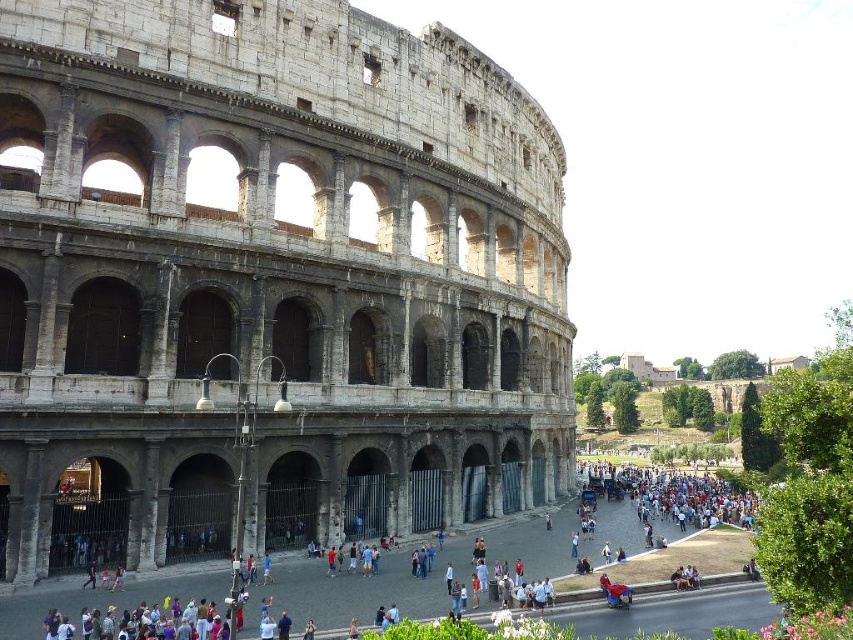
You are standing at the point with coordinates (273, 276) in the Colosseum image. What structure are you currently on?

The point with coordinates (273, 276) is on the gray stone amphitheater at center.

You are a tourist standing in front of the Colosseum and want to take a photo of the gray stone amphitheater at center and the matte gray crowd at center. Which object should you focus on first if you want to capture both in the same frame?

The gray stone amphitheater at center is to the left of matte gray crowd at center, so you should focus on the gray stone amphitheater at center first to ensure both are in the frame.

You are a tour guide planning to lead a group through the Colosseum area. You need to ensure there is enough space between the gray stone amphitheater at center and the matte gray crowd at center for your group to pass comfortably. Based on their widths, can your group of 10 people walk side by side between them?

The gray stone amphitheater at center is thinner than the matte gray crowd at center. Since the crowd is wider, the space between them may not be sufficient for 10 people to walk side by side comfortably.